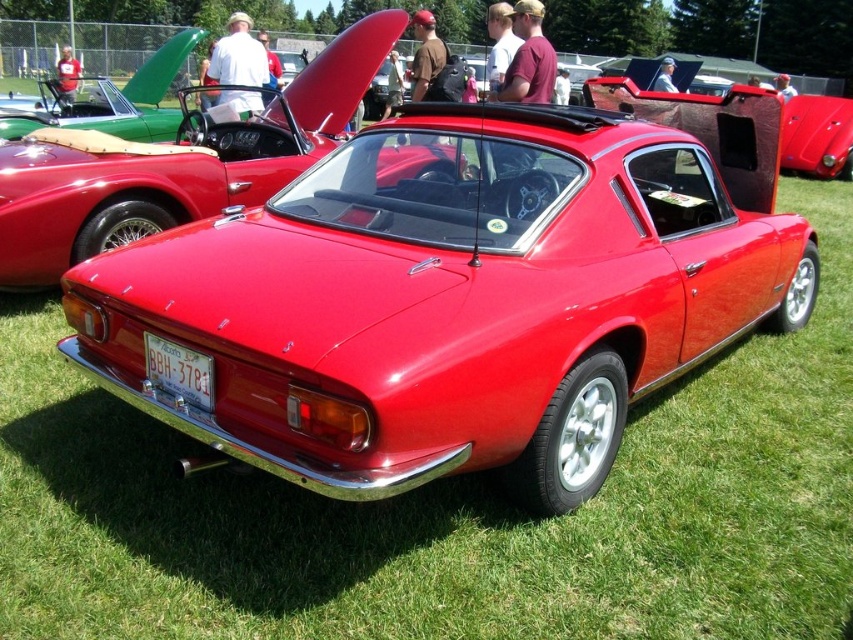
Can you confirm if glossy red car at center is thinner than white plastic license plate at lower center?

No, glossy red car at center is not thinner than white plastic license plate at lower center.

Locate an element on the screen. The height and width of the screenshot is (640, 853). glossy red car at center is located at coordinates (175, 163).

Where is `glossy red car at center`? This screenshot has height=640, width=853. glossy red car at center is located at coordinates (175, 163).

Between glossy red convertible at center and white plastic license plate at lower center, which one is positioned lower?

white plastic license plate at lower center is below.

Which is in front, point (851, 112) or point (167, 348)?

Point (167, 348)

Where is `glossy red convertible at center`? This screenshot has width=853, height=640. glossy red convertible at center is located at coordinates (817, 136).

Who is positioned more to the left, glossy red car at center or glossy red convertible at center?

glossy red car at center is more to the left.

How much distance is there between glossy red car at center and glossy red convertible at center?

The distance of glossy red car at center from glossy red convertible at center is 7.12 meters.

The width and height of the screenshot is (853, 640). In order to click on glossy red car at center in this screenshot , I will do `click(175, 163)`.